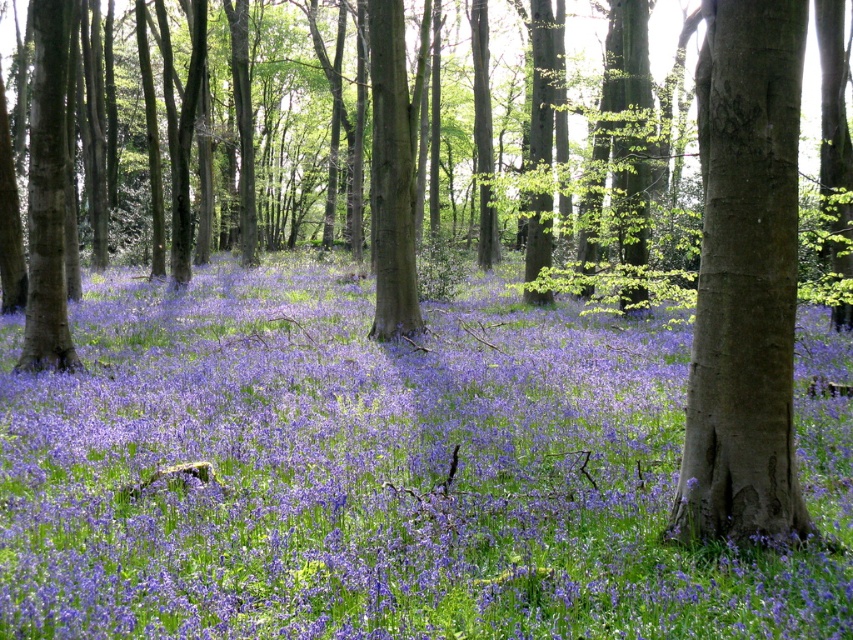
Question: Which object is farther from the camera taking this photo?

Choices:
 (A) brown rough bark tree at right
 (B) purple matte flower at center

Answer: (A)

Question: Among these objects, which one is farthest from the camera?

Choices:
 (A) purple matte flower at center
 (B) brown rough bark tree at right

Answer: (B)

Question: Which object appears closest to the camera in this image?

Choices:
 (A) purple matte flower at center
 (B) brown rough bark tree at right

Answer: (A)

Question: Does purple matte flower at center appear on the right side of brown rough bark tree at right?

Choices:
 (A) no
 (B) yes

Answer: (A)

Question: Is purple matte flower at center to the right of brown rough bark tree at right from the viewer's perspective?

Choices:
 (A) no
 (B) yes

Answer: (A)

Question: Is purple matte flower at center behind brown rough bark tree at right?

Choices:
 (A) no
 (B) yes

Answer: (A)